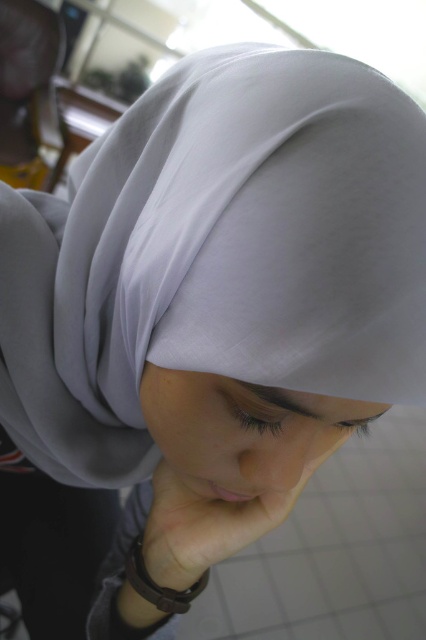
In the scene shown: Does smooth skin at center have a greater width compared to pink smooth skin at lower center?

Yes.

Who is more forward, [164,515] or [209,490]?

Point [209,490] is more forward.

Locate an element on the screen. The image size is (426, 640). smooth skin at center is located at coordinates (206, 524).